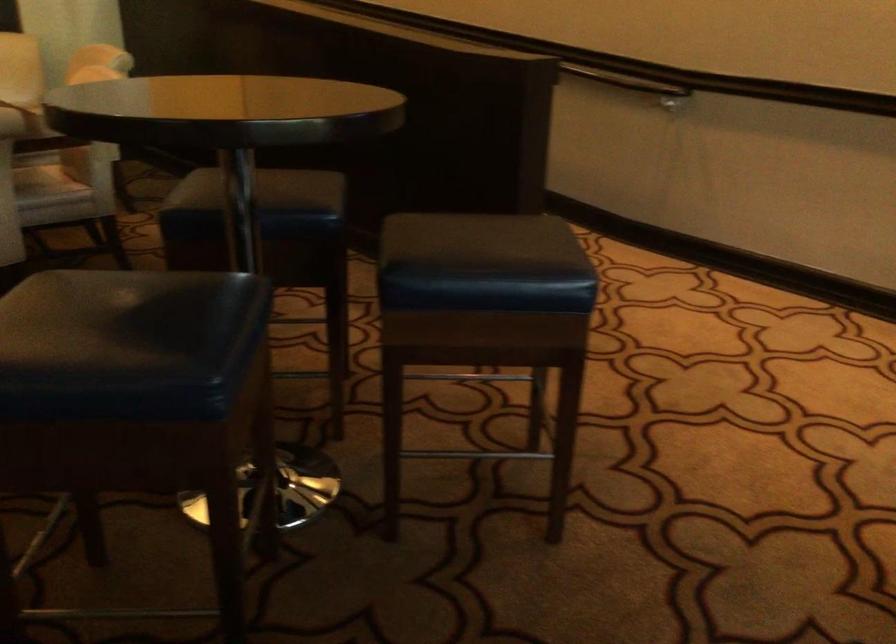
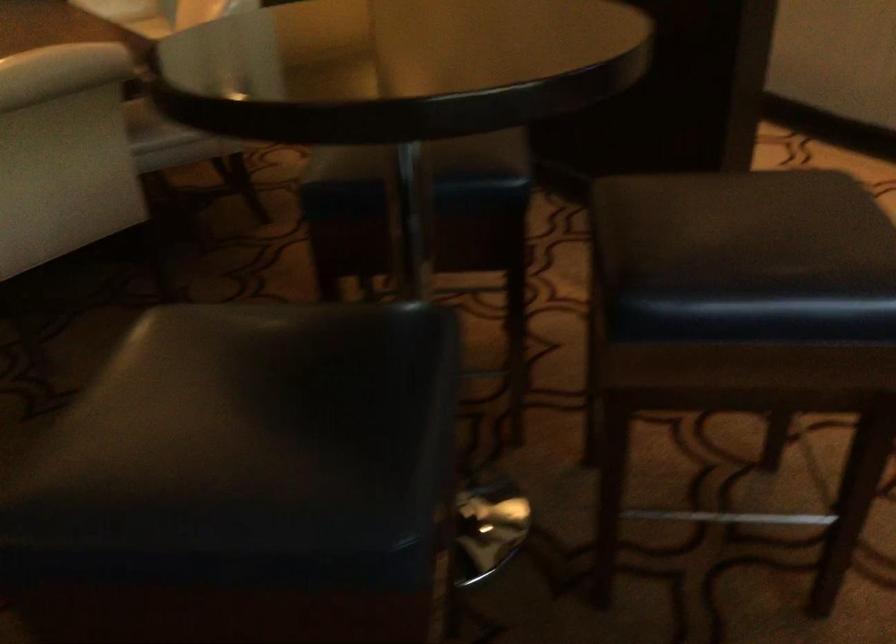
In a continuous first-person perspective shot, in which direction is the camera moving?

The cameraman moved toward left, forward.